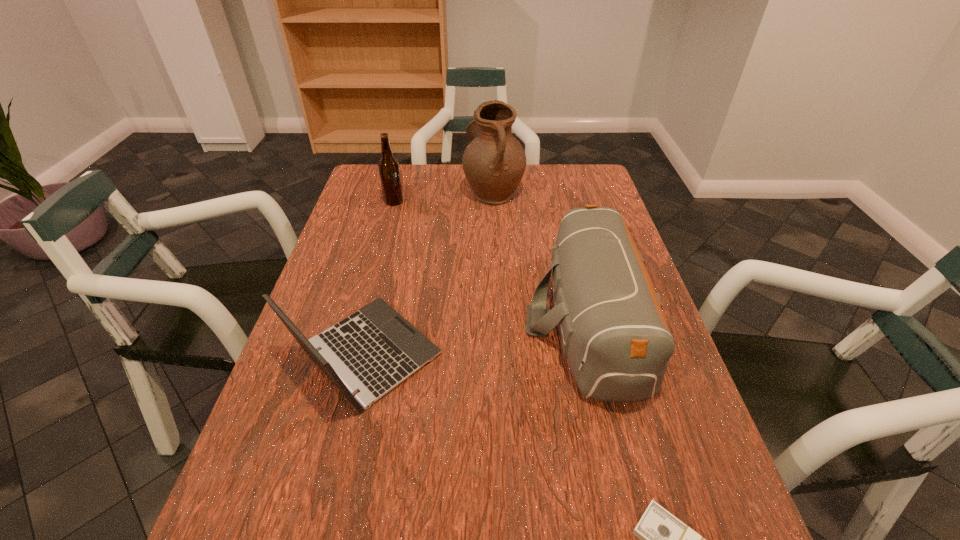
Where is `pitcher`? The height and width of the screenshot is (540, 960). pitcher is located at coordinates (494, 162).

Locate an element on the screen. The width and height of the screenshot is (960, 540). beer bottle is located at coordinates (389, 171).

This screenshot has width=960, height=540. I want to click on duffel bag, so click(x=614, y=334).

The width and height of the screenshot is (960, 540). What are the coordinates of `laptop_computer` in the screenshot? It's located at [x=373, y=350].

The height and width of the screenshot is (540, 960). What are the coordinates of `vacant area situated 0.270m at the spout of the pitcher` in the screenshot? It's located at (381, 192).

You are a GUI agent. You are given a task and a screenshot of the screen. Output one action in this format:
    pyautogui.click(x=<x>, y=<y>)
    Task: Click on the vacant space located at the spout of the pitcher
    
    Given the screenshot: What is the action you would take?
    pyautogui.click(x=357, y=192)

Where is `vacant region located 0.110m at the spout of the pitcher`? vacant region located 0.110m at the spout of the pitcher is located at coordinates (430, 192).

The height and width of the screenshot is (540, 960). I want to click on vacant space located on the label of the beer bottle, so click(x=419, y=202).

Where is `vacant space located on the left of the duffel bag`? vacant space located on the left of the duffel bag is located at coordinates (399, 321).

The width and height of the screenshot is (960, 540). In order to click on free spot located 0.110m at the front screen of the laptop_computer in this screenshot , I will do `click(493, 355)`.